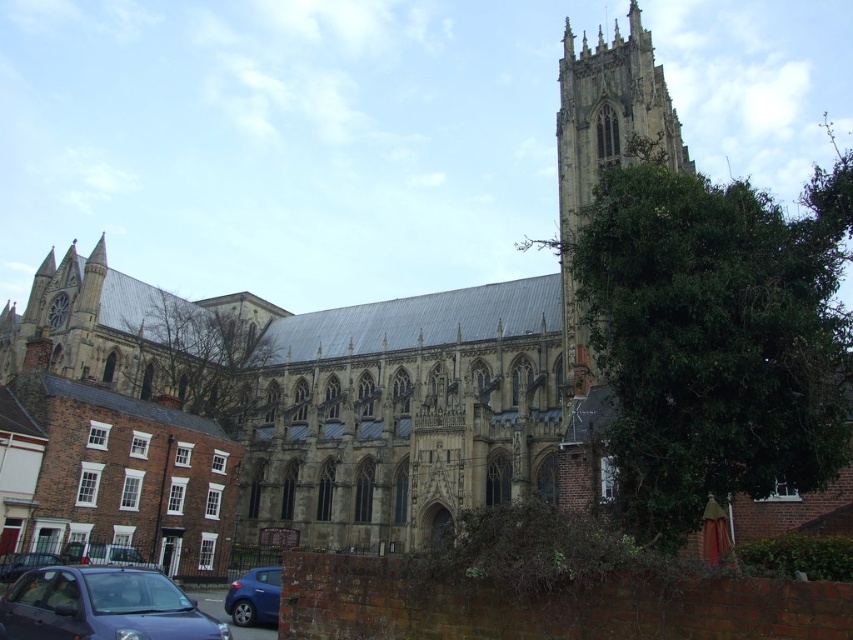
Question: Observing the image, what is the correct spatial positioning of bare branches at center in reference to matte black car at lower left?

Choices:
 (A) right
 (B) left

Answer: (B)

Question: Does matte blue car at lower left appear under matte black car at lower left?

Choices:
 (A) yes
 (B) no

Answer: (B)

Question: Which object is positioned closest to the metallic blue car at lower left?

Choices:
 (A) matte blue car at lower left
 (B) stone church at center

Answer: (A)

Question: Which point is farther to the camera?

Choices:
 (A) matte black car at lower left
 (B) stone church at center
 (C) green leafy tree at right
 (D) matte blue car at lower left

Answer: (B)

Question: Which object is positioned farthest from the smooth stone tower at upper right?

Choices:
 (A) metallic blue car at lower left
 (B) green leafy tree at right

Answer: (A)

Question: Is matte blue car at lower left above blue metallic car at lower left?

Choices:
 (A) no
 (B) yes

Answer: (B)